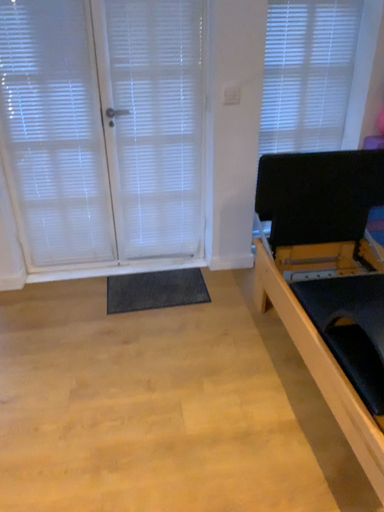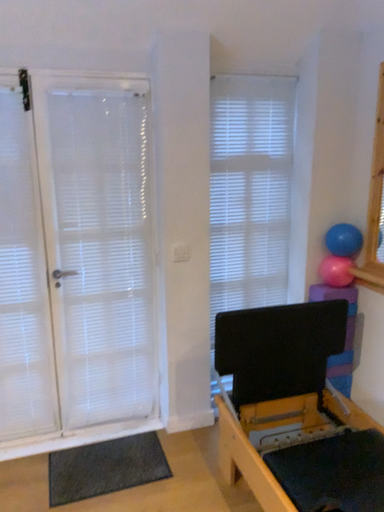
Question: Which way did the camera rotate in the video?

Choices:
 (A) rotated upward
 (B) rotated downward

Answer: (A)